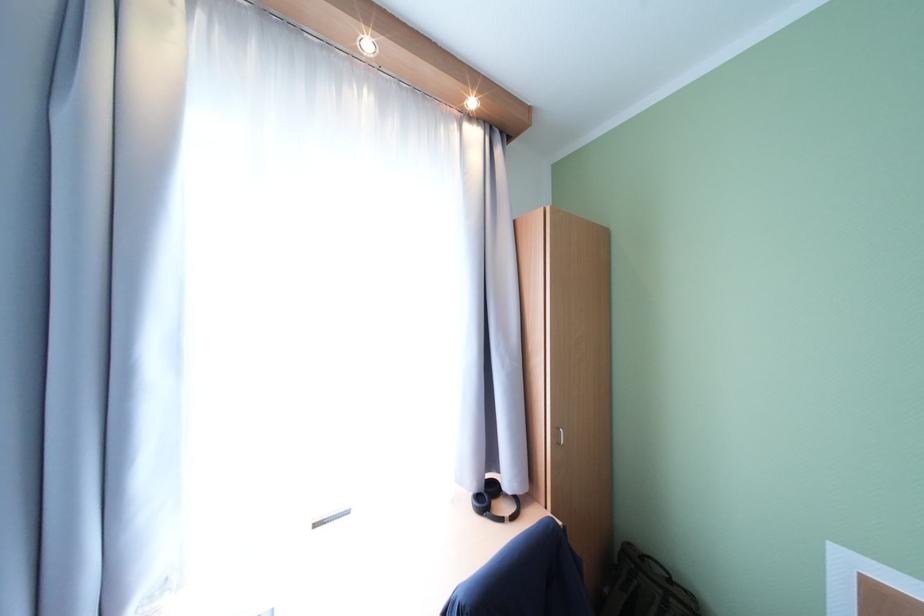
You are a GUI agent. You are given a task and a screenshot of the screen. Output one action in this format:
    pyautogui.click(x=<x>, y=<y>)
    Task: Click on the silver cabinet handle
    
    Given the screenshot: What is the action you would take?
    click(558, 436)